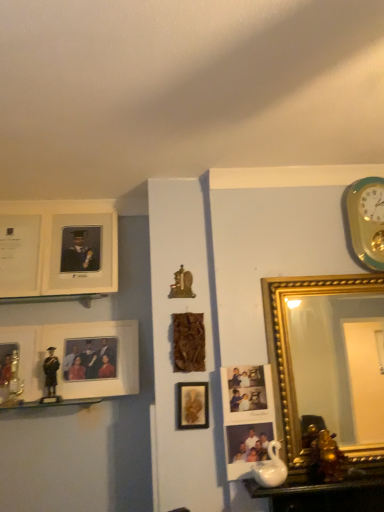
Question: Does point (377, 233) appear closer or farther from the camera than point (84, 354)?

Choices:
 (A) farther
 (B) closer

Answer: (B)

Question: Is teal-golden wall clock at upper right wider or thinner than matte white picture frame at left, the 5th picture frame from the right?

Choices:
 (A) wide
 (B) thin

Answer: (B)

Question: Which object is the farthest from the wooden plaque at center, which is the sixth picture frame in left-to-right order?

Choices:
 (A) white glossy table at lower right
 (B) white matte picture frame at upper left, arranged as the ninth picture frame when viewed from the right
 (C) gold metallic picture frame at left, which is the third picture frame in left-to-right order
 (D) matte white picture frame at left, the 5th picture frame from the right
 (E) teal-golden wall clock at upper right

Answer: (E)

Question: Which is farther from the wooden plaque at center, which is the fourth picture frame in right-to-left order?

Choices:
 (A) metallic gold picture frame at left, the second picture frame when ordered from left to right
 (B) matte white picture frame at left, the 5th picture frame from the right
 (C) gold metallic picture frame at left, the seventh picture frame in the right-to-left sequence
 (D) teal-golden wall clock at upper right
 (E) gold/gilded mirror at right, the ninth picture frame positioned from the left

Answer: (D)